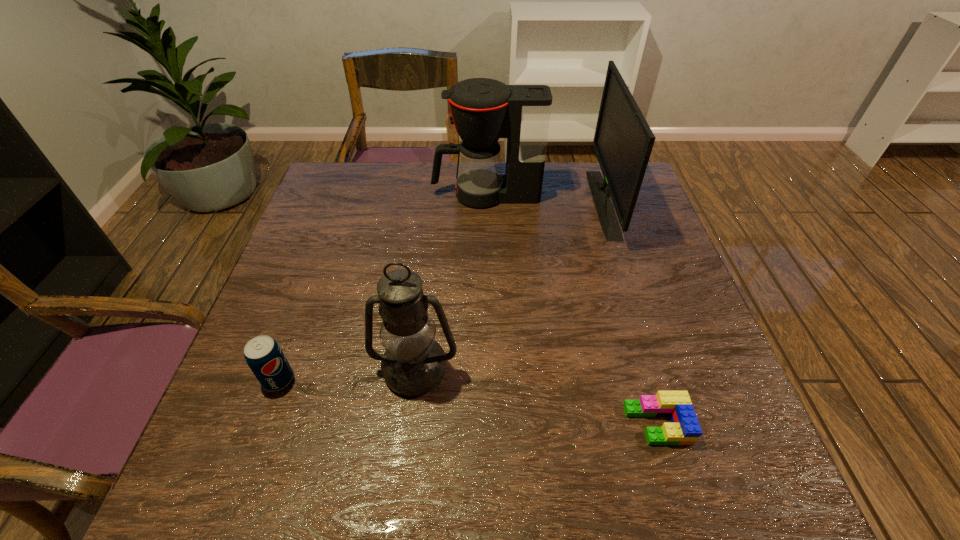
At what (x,y) coordinates should I click in order to perform the action: click on Lego located in the right edge section of the desktop. Please return your answer as a coordinate pair (x, y). Looking at the image, I should click on (684, 429).

Locate an element on the screen. This screenshot has width=960, height=540. object that is at the far right corner is located at coordinates (623, 141).

In the image, there is a desktop. Identify the location of free region at the far edge. (554, 183).

In the image, there is a desktop. What are the coordinates of `vacant space at the near edge` in the screenshot? It's located at (527, 475).

At what (x,y) coordinates should I click in order to perform the action: click on blank space at the right edge. Please return your answer as a coordinate pair (x, y). Looking at the image, I should click on (624, 290).

In order to click on blank space at the near right corner of the desktop in this screenshot , I will do `click(723, 452)`.

Image resolution: width=960 pixels, height=540 pixels. Find the location of `free point between the coffee maker and the nearest object`. free point between the coffee maker and the nearest object is located at coordinates (571, 309).

Where is `free point between the coffee maker and the oil lamp`? free point between the coffee maker and the oil lamp is located at coordinates (450, 282).

Where is `free spot between the shortest object and the oil lamp`? free spot between the shortest object and the oil lamp is located at coordinates (536, 396).

This screenshot has width=960, height=540. I want to click on free space between the coffee maker and the Lego, so click(x=571, y=309).